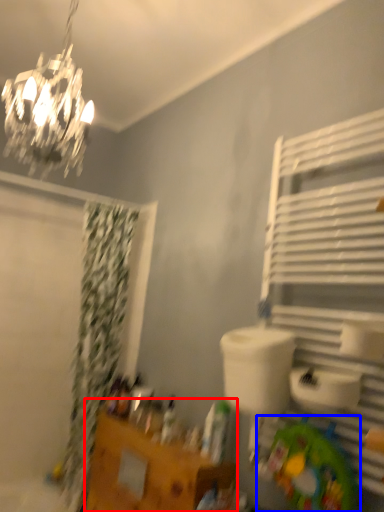
Question: Among these objects, which one is farthest to the camera, vanity (highlighted by a red box) or toy (highlighted by a blue box)?

Choices:
 (A) vanity
 (B) toy

Answer: (A)